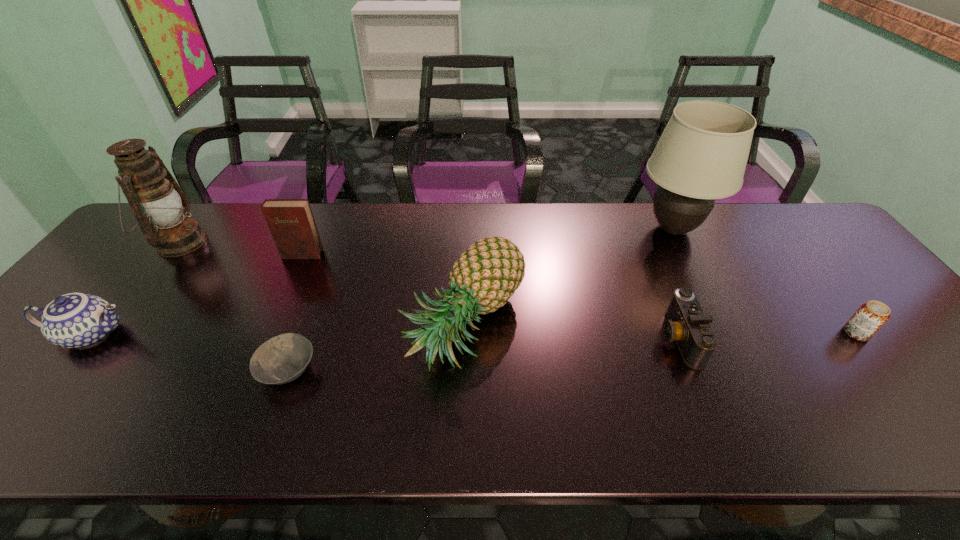
The width and height of the screenshot is (960, 540). Identify the location of free region located on the right of the pineapple. (554, 324).

Locate an element on the screen. Image resolution: width=960 pixels, height=540 pixels. free space located on the front cover of the diary is located at coordinates (277, 312).

This screenshot has width=960, height=540. Identify the location of free space located 0.360m from the spout of the chinaware. (285, 334).

Locate an element on the screen. vacant area situated on the left of the beer can is located at coordinates (696, 333).

The width and height of the screenshot is (960, 540). In order to click on free region located on the lens of the camera in this screenshot , I will do `click(515, 338)`.

The width and height of the screenshot is (960, 540). Find the location of `free space located 0.310m on the lens of the camera`. free space located 0.310m on the lens of the camera is located at coordinates (531, 338).

Find the location of `free region located 0.340m on the lens of the camera`. free region located 0.340m on the lens of the camera is located at coordinates (518, 338).

Identify the location of free space located 0.310m on the left of the bowl. This screenshot has height=540, width=960. (120, 370).

Identify the location of lampshade located at the far edge. (702, 154).

Identify the location of lantern situated at the far edge. (154, 196).